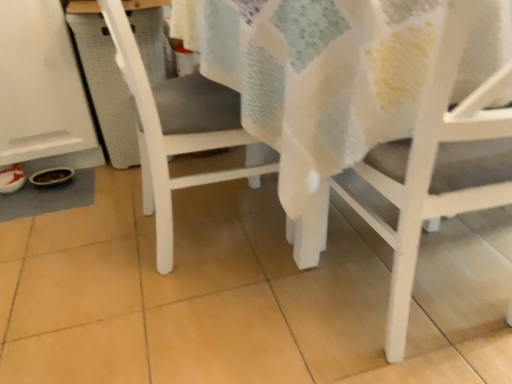
How much space does white matte chair at center, arranged as the second chair when viewed from the right, occupy vertically?

white matte chair at center, arranged as the second chair when viewed from the right, is 28.49 inches in height.

Measure the distance between white matte chair at center, which ranks as the 1th chair in left-to-right order, and camera.

The depth of white matte chair at center, which ranks as the 1th chair in left-to-right order, is 34.70 inches.

Image resolution: width=512 pixels, height=384 pixels. What do you see at coordinates (178, 129) in the screenshot?
I see `white matte chair at center, which ranks as the 1th chair in left-to-right order` at bounding box center [178, 129].

Find the location of a particular element. The width and height of the screenshot is (512, 384). white matte chair at center, which ranks as the 1th chair in left-to-right order is located at coordinates (178, 129).

Describe the element at coordinates (438, 165) in the screenshot. I see `white matte chair at lower right, arranged as the second chair when viewed from the left` at that location.

At what (x,y) coordinates should I click in order to perform the action: click on white matte chair at lower right, arranged as the second chair when viewed from the left. Please return your answer as a coordinate pair (x, y). The height and width of the screenshot is (384, 512). Looking at the image, I should click on (438, 165).

The image size is (512, 384). Identify the location of white matte chair at center, which ranks as the 1th chair in left-to-right order. (178, 129).

Which object is positioned more to the left, white matte chair at center, arranged as the second chair when viewed from the right, or white matte chair at lower right, the 1th chair viewed from the right?

white matte chair at center, arranged as the second chair when viewed from the right.

Considering the relative positions of white matte chair at center, which ranks as the 1th chair in left-to-right order, and white matte chair at lower right, the 1th chair viewed from the right, in the image provided, is white matte chair at center, which ranks as the 1th chair in left-to-right order, in front of white matte chair at lower right, the 1th chair viewed from the right,?

No, white matte chair at center, which ranks as the 1th chair in left-to-right order, is behind white matte chair at lower right, the 1th chair viewed from the right.

Which is in front, point (165, 92) or point (435, 96)?

Positioned in front is point (435, 96).

From the image's perspective, between white matte chair at center, arranged as the second chair when viewed from the right, and white matte chair at lower right, arranged as the second chair when viewed from the left, who is located below?

white matte chair at lower right, arranged as the second chair when viewed from the left, is shown below in the image.

From the picture: From a real-world perspective, between white matte chair at center, which ranks as the 1th chair in left-to-right order, and white matte chair at lower right, the 1th chair viewed from the right, who is vertically higher?

white matte chair at lower right, the 1th chair viewed from the right.

Considering the sizes of white matte chair at center, arranged as the second chair when viewed from the right, and white matte chair at lower right, arranged as the second chair when viewed from the left, in the image, is white matte chair at center, arranged as the second chair when viewed from the right, wider or thinner than white matte chair at lower right, arranged as the second chair when viewed from the left,?

Clearly, white matte chair at center, arranged as the second chair when viewed from the right, has more width compared to white matte chair at lower right, arranged as the second chair when viewed from the left.

Does white matte chair at center, which ranks as the 1th chair in left-to-right order, have a greater height compared to white matte chair at lower right, arranged as the second chair when viewed from the left?

In fact, white matte chair at center, which ranks as the 1th chair in left-to-right order, may be shorter than white matte chair at lower right, arranged as the second chair when viewed from the left.

Does white matte chair at center, which ranks as the 1th chair in left-to-right order, have a larger size compared to white matte chair at lower right, arranged as the second chair when viewed from the left?

Yes, white matte chair at center, which ranks as the 1th chair in left-to-right order, is bigger than white matte chair at lower right, arranged as the second chair when viewed from the left.

Is white matte chair at lower right, the 1th chair viewed from the right, located within white matte chair at center, arranged as the second chair when viewed from the right?

Definitely not — white matte chair at lower right, the 1th chair viewed from the right, is not inside white matte chair at center, arranged as the second chair when viewed from the right.

In the scene shown: Is white matte chair at center, which ranks as the 1th chair in left-to-right order, not close to white matte chair at lower right, arranged as the second chair when viewed from the left?

Actually, white matte chair at center, which ranks as the 1th chair in left-to-right order, and white matte chair at lower right, arranged as the second chair when viewed from the left, are a little close together.

Is white matte chair at center, which ranks as the 1th chair in left-to-right order, facing away from white matte chair at lower right, arranged as the second chair when viewed from the left?

No.

How many degrees apart are the facing directions of white matte chair at center, which ranks as the 1th chair in left-to-right order, and white matte chair at lower right, arranged as the second chair when viewed from the left?

The facing directions of white matte chair at center, which ranks as the 1th chair in left-to-right order, and white matte chair at lower right, arranged as the second chair when viewed from the left, are 90 degrees apart.

Find the location of a particular element. The width and height of the screenshot is (512, 384). chair that is on the left side of white matte chair at lower right, arranged as the second chair when viewed from the left is located at coordinates (178, 129).

Considering the positions of objects white matte chair at lower right, the 1th chair viewed from the right, and white matte chair at center, which ranks as the 1th chair in left-to-right order, in the image provided, who is more to the right, white matte chair at lower right, the 1th chair viewed from the right, or white matte chair at center, which ranks as the 1th chair in left-to-right order,?

white matte chair at lower right, the 1th chair viewed from the right, is more to the right.

Considering the relative positions of white matte chair at lower right, arranged as the second chair when viewed from the left, and white matte chair at center, which ranks as the 1th chair in left-to-right order, in the image provided, is white matte chair at lower right, arranged as the second chair when viewed from the left, in front of white matte chair at center, which ranks as the 1th chair in left-to-right order,?

Yes, it is.

Is point (463, 117) closer or farther from the camera than point (192, 102)?

Point (463, 117) appears to be closer to the viewer than point (192, 102).

From the image's perspective, who appears lower, white matte chair at lower right, arranged as the second chair when viewed from the left, or white matte chair at center, arranged as the second chair when viewed from the right?

white matte chair at lower right, arranged as the second chair when viewed from the left, from the image's perspective.

From a real-world perspective, which is physically below, white matte chair at lower right, arranged as the second chair when viewed from the left, or white matte chair at center, arranged as the second chair when viewed from the right?

→ In real-world perspective, white matte chair at center, arranged as the second chair when viewed from the right, is lower.

Considering the sizes of objects white matte chair at lower right, arranged as the second chair when viewed from the left, and white matte chair at center, which ranks as the 1th chair in left-to-right order, in the image provided, who is wider, white matte chair at lower right, arranged as the second chair when viewed from the left, or white matte chair at center, which ranks as the 1th chair in left-to-right order,?

white matte chair at center, which ranks as the 1th chair in left-to-right order, is wider.

In terms of height, does white matte chair at lower right, the 1th chair viewed from the right, look taller or shorter compared to white matte chair at center, arranged as the second chair when viewed from the right?

In the image, white matte chair at lower right, the 1th chair viewed from the right, appears to be taller than white matte chair at center, arranged as the second chair when viewed from the right.

Between white matte chair at lower right, the 1th chair viewed from the right, and white matte chair at center, which ranks as the 1th chair in left-to-right order, which one has smaller size?

white matte chair at lower right, the 1th chair viewed from the right, is smaller.

Is white matte chair at lower right, the 1th chair viewed from the right, not inside white matte chair at center, arranged as the second chair when viewed from the right?

Yes, white matte chair at lower right, the 1th chair viewed from the right, is not within white matte chair at center, arranged as the second chair when viewed from the right.

Is white matte chair at lower right, the 1th chair viewed from the right, touching white matte chair at center, arranged as the second chair when viewed from the right?

There is a gap between white matte chair at lower right, the 1th chair viewed from the right, and white matte chair at center, arranged as the second chair when viewed from the right.

Is white matte chair at lower right, the 1th chair viewed from the right, turned away from white matte chair at center, arranged as the second chair when viewed from the right?

No, white matte chair at lower right, the 1th chair viewed from the right,'s orientation is not away from white matte chair at center, arranged as the second chair when viewed from the right.

Where is `chair above the white matte chair at lower right, arranged as the second chair when viewed from the left (from the image's perspective)`? chair above the white matte chair at lower right, arranged as the second chair when viewed from the left (from the image's perspective) is located at coordinates 178,129.

Locate an element on the screen. The width and height of the screenshot is (512, 384). chair on the right of white matte chair at center, which ranks as the 1th chair in left-to-right order is located at coordinates (438, 165).

I want to click on chair above the white matte chair at lower right, the 1th chair viewed from the right (from the image's perspective), so click(x=178, y=129).